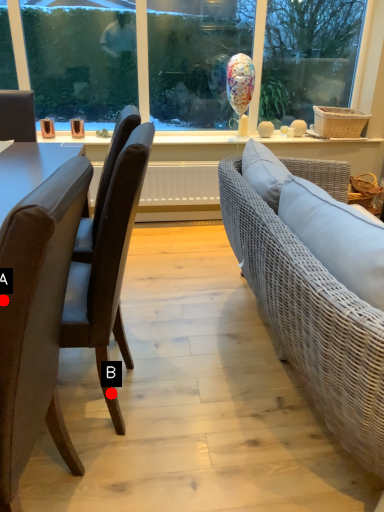
Question: Two points are circled on the image, labeled by A and B beside each circle. Which of the following is the farthest from the observer?

Choices:
 (A) A is further
 (B) B is further

Answer: (B)